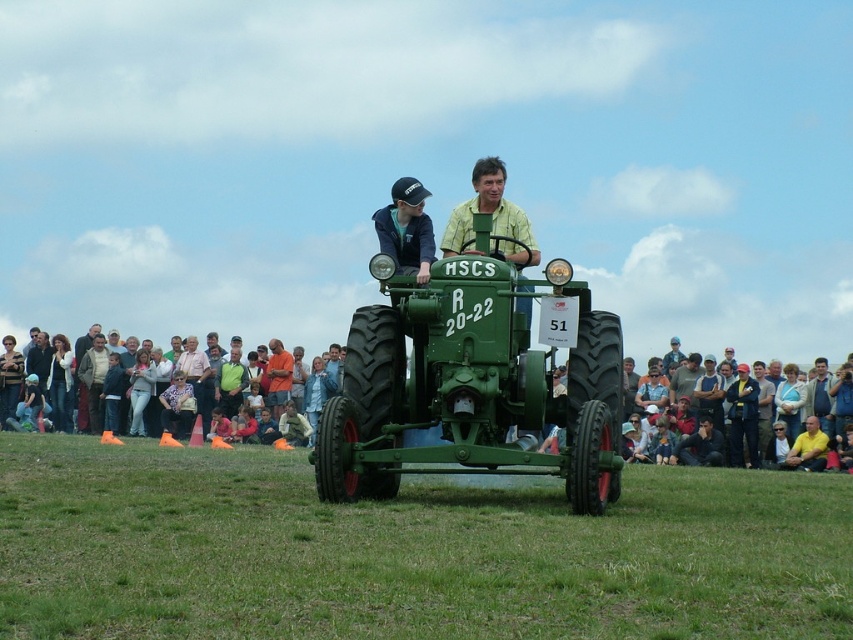
Between point (85, 496) and point (764, 456), which one is positioned in front?

Point (85, 496)

Which is behind, point (659, 538) or point (761, 400)?

Point (761, 400)

This screenshot has height=640, width=853. Find the location of `green rubber tractor at center`. green rubber tractor at center is located at coordinates (405, 550).

Where is `green rubber tractor at center`? The image size is (853, 640). green rubber tractor at center is located at coordinates (405, 550).

Who is lower down, green matte tractor at center or light brown fabric crowd at lower right?

light brown fabric crowd at lower right is lower down.

Is green matte tractor at center wider than light brown fabric crowd at lower right?

In fact, green matte tractor at center might be narrower than light brown fabric crowd at lower right.

What do you see at coordinates (469, 385) in the screenshot? I see `green matte tractor at center` at bounding box center [469, 385].

Identify the location of green matte tractor at center. (469, 385).

Is denim jacket at lower left closer to the viewer compared to dark blue jacket at center?

No, denim jacket at lower left is behind dark blue jacket at center.

Is point (59, 406) positioned before point (751, 444)?

No, (59, 406) is further to viewer.

Is point (25, 364) positioned before point (735, 413)?

No, (25, 364) is further to viewer.

Where is `denim jacket at lower left`? This screenshot has height=640, width=853. denim jacket at lower left is located at coordinates (49, 380).